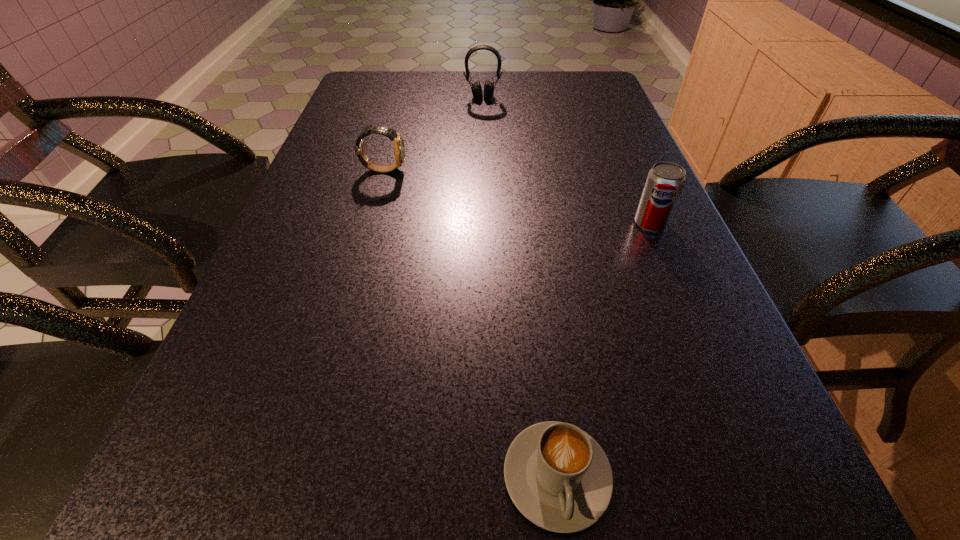
Locate an element on the screen. This screenshot has height=540, width=960. blank space that satisfies the following two spatial constraints: 1. on the face of the watch; 2. on the right side of the soda is located at coordinates (368, 224).